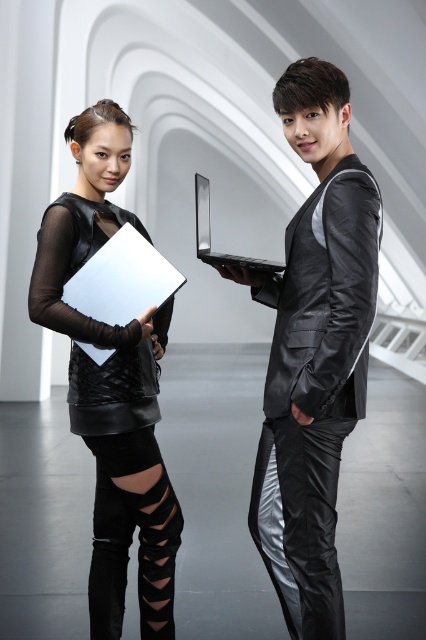
Based on the photo, does matte black dress at left lie behind black leather dress at left?

No, matte black dress at left is in front of black leather dress at left.

Based on the photo, who is taller, matte black dress at left or black leather dress at left?

With more height is matte black dress at left.

Is point (169, 602) farther from viewer compared to point (138, 333)?

Yes, it is.

Identify the location of matte black dress at left. (112, 385).

The width and height of the screenshot is (426, 640). Describe the element at coordinates (121, 280) in the screenshot. I see `white matte clipboard at left` at that location.

Is white matte clipboard at left bigger than silver metallic laptop at center?

No.

Is point (72, 280) farther from viewer compared to point (255, 257)?

No, it is not.

You are a GUI agent. You are given a task and a screenshot of the screen. Output one action in this format:
    pyautogui.click(x=<x>, y=<y>)
    Task: Click on the white matte clipboard at left
    
    Given the screenshot: What is the action you would take?
    pyautogui.click(x=121, y=280)

Which is more to the right, shiny black leather jacket at center or matte black dress at left?

shiny black leather jacket at center

Is point (279, 81) less distant than point (147, 365)?

Yes, it is.

Identify the location of shiny black leather jacket at center. The height and width of the screenshot is (640, 426). (313, 352).